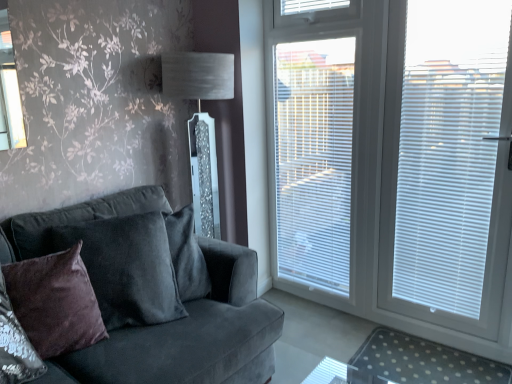
Describe the element at coordinates (311, 6) in the screenshot. I see `white plastic blinds at upper center, which ranks as the first blind in left-to-right order` at that location.

The width and height of the screenshot is (512, 384). Describe the element at coordinates (445, 184) in the screenshot. I see `white plastic blinds at right, positioned as the 1th blind in right-to-left order` at that location.

You are a GUI agent. You are given a task and a screenshot of the screen. Output one action in this format:
    pyautogui.click(x=<x>, y=<y>)
    Task: Click on the white plastic blinds at upper center, acting as the third blind starting from the right
    
    Given the screenshot: What is the action you would take?
    coord(311,6)

Between clear polka dot mat at lower right and white blinds at right, which one appears on the right side from the viewer's perspective?

From the viewer's perspective, clear polka dot mat at lower right appears more on the right side.

Considering the positions of points (463, 358) and (282, 232), is point (463, 358) closer to camera compared to point (282, 232)?

Yes.

From the image's perspective, is clear polka dot mat at lower right located above white blinds at right?

No, from the image's perspective, clear polka dot mat at lower right is not on top of white blinds at right.

This screenshot has width=512, height=384. What are the coordinates of `window above the clear polka dot mat at lower right (from the image's perspective)` in the screenshot? It's located at (392, 159).

From the image's perspective, is velvet dark gray couch at left located above or below white plastic blinds at right, which is counted as the second blind, starting from the right?

From the image's perspective, velvet dark gray couch at left appears below white plastic blinds at right, which is counted as the second blind, starting from the right.

Would you consider velvet dark gray couch at left to be distant from white plastic blinds at right, which is counted as the 2th blind, starting from the left?

velvet dark gray couch at left is far away from white plastic blinds at right, which is counted as the 2th blind, starting from the left.

From a real-world perspective, who is located lower, velvet dark gray couch at left or white plastic blinds at right, which is counted as the second blind, starting from the right?

velvet dark gray couch at left.

Does velvet dark gray couch at left have a greater width compared to white plastic blinds at right, which is counted as the 2th blind, starting from the left?

Yes.

Considering the positions of objects velvet brown pillow at left and white blinds at right in the image provided, who is more to the right, velvet brown pillow at left or white blinds at right?

white blinds at right is more to the right.

Looking at this image, which of these two, velvet brown pillow at left or white blinds at right, is wider?

Wider between the two is velvet brown pillow at left.

Does point (67, 288) come farther from viewer compared to point (386, 25)?

No, it is not.

Is point (425, 357) less distant than point (304, 0)?

Yes.

Is white plastic blinds at upper center, acting as the third blind starting from the right, at the back of clear polka dot mat at lower right?

No, clear polka dot mat at lower right is not facing the opposite direction of white plastic blinds at upper center, acting as the third blind starting from the right.

From the image's perspective, is clear polka dot mat at lower right on white plastic blinds at upper center, acting as the third blind starting from the right?

No, from the image's perspective, clear polka dot mat at lower right is not over white plastic blinds at upper center, acting as the third blind starting from the right.

Find the location of a particular element. the 2nd blind behind the clear polka dot mat at lower right, counting from the anchor's position is located at coordinates (311, 6).

Choose the correct answer: Is white plastic blinds at right, which is counted as the 2th blind, starting from the left, inside white plastic blinds at upper center, acting as the third blind starting from the right, or outside it?

white plastic blinds at right, which is counted as the 2th blind, starting from the left, cannot be found inside white plastic blinds at upper center, acting as the third blind starting from the right.

Which object is wider, white plastic blinds at right, which is counted as the 2th blind, starting from the left, or white plastic blinds at upper center, acting as the third blind starting from the right?

With larger width is white plastic blinds at right, which is counted as the 2th blind, starting from the left.

Does white plastic blinds at right, which is counted as the second blind, starting from the right, have a larger size compared to white plastic blinds at upper center, acting as the third blind starting from the right?

Yes, white plastic blinds at right, which is counted as the second blind, starting from the right, is bigger than white plastic blinds at upper center, acting as the third blind starting from the right.

Can you confirm if white plastic blinds at right, which is counted as the second blind, starting from the right, is positioned to the left of velvet brown pillow at left?

In fact, white plastic blinds at right, which is counted as the second blind, starting from the right, is to the right of velvet brown pillow at left.

Is white plastic blinds at right, which is counted as the 2th blind, starting from the left, positioned with its back to velvet brown pillow at left?

No, white plastic blinds at right, which is counted as the 2th blind, starting from the left, is not facing the opposite direction of velvet brown pillow at left.

Identify the location of pillow lying on the left of white plastic blinds at right, which is counted as the second blind, starting from the right. The image size is (512, 384). (55, 302).

Is velvet brown pillow at left bigger than velvet dark gray couch at left?

Actually, velvet brown pillow at left might be smaller than velvet dark gray couch at left.

How different are the orientations of velvet brown pillow at left and velvet dark gray couch at left in degrees?

There is a 26.8-degree angle between the facing directions of velvet brown pillow at left and velvet dark gray couch at left.

Is point (20, 317) closer to viewer compared to point (49, 360)?

That is True.

Based on the photo, from a real-world perspective, is velvet brown pillow at left physically above velvet dark gray couch at left?

Yes, from a real-world perspective, velvet brown pillow at left is over velvet dark gray couch at left

Locate an element on the screen. The height and width of the screenshot is (384, 512). plain on the right of the white blinds at right is located at coordinates (422, 362).

Locate an element on the screen. This screenshot has height=384, width=512. studio couch below the white plastic blinds at right, which is counted as the second blind, starting from the right (from a real-world perspective) is located at coordinates coord(156,297).

From the image, which object appears to be farther from velvet dark gray couch at left, white plastic blinds at right, which is counted as the 2th blind, starting from the left, or clear polka dot mat at lower right?

Based on the image, white plastic blinds at right, which is counted as the 2th blind, starting from the left, appears to be further to velvet dark gray couch at left.

Estimate the real-world distances between objects in this image. Which object is closer to velvet dark gray couch at left, clear polka dot mat at lower right or white plastic blinds at right, positioned as the 1th blind in right-to-left order?

clear polka dot mat at lower right is closer to velvet dark gray couch at left.

Considering their positions, is clear polka dot mat at lower right positioned further to white plastic blinds at upper center, which ranks as the first blind in left-to-right order, than velvet brown pillow at left?

Answer: Based on the image, velvet brown pillow at left appears to be further to white plastic blinds at upper center, which ranks as the first blind in left-to-right order.

From the picture: Estimate the real-world distances between objects in this image. Which object is further from velvet brown pillow at left, white plastic blinds at right, positioned as the third blind in left-to-right order, or white plastic blinds at right, which is counted as the 2th blind, starting from the left?

Among the two, white plastic blinds at right, positioned as the third blind in left-to-right order, is located further to velvet brown pillow at left.

Considering their positions, is white plastic blinds at right, positioned as the 1th blind in right-to-left order, positioned further to clear polka dot mat at lower right than white plastic blinds at upper center, acting as the third blind starting from the right?

white plastic blinds at upper center, acting as the third blind starting from the right, lies further to clear polka dot mat at lower right than the other object.

When comparing their distances from velvet brown pillow at left, does velvet dark gray couch at left or white blinds at right seem further?

white blinds at right.

From the image, which object appears to be nearer to velvet dark gray couch at left, velvet brown pillow at left or clear polka dot mat at lower right?

The object closer to velvet dark gray couch at left is velvet brown pillow at left.

Estimate the real-world distances between objects in this image. Which object is further from velvet dark gray couch at left, white blinds at right or white plastic blinds at right, which is counted as the 2th blind, starting from the left?

white blinds at right.

Find the location of `window between white plastic blinds at upper center, acting as the third blind starting from the right, and velvet brown pillow at left, in the vertical direction`. window between white plastic blinds at upper center, acting as the third blind starting from the right, and velvet brown pillow at left, in the vertical direction is located at coordinates (392, 159).

Image resolution: width=512 pixels, height=384 pixels. In order to click on plain situated between velvet dark gray couch at left and white plastic blinds at right, positioned as the 1th blind in right-to-left order, from left to right in this screenshot , I will do `click(422, 362)`.

Find the location of a particular element. window between velvet dark gray couch at left and white plastic blinds at right, which is counted as the 2th blind, starting from the left, from front to back is located at coordinates (392, 159).

At what (x,y) coordinates should I click in order to perform the action: click on studio couch between velvet brown pillow at left and white blinds at right in the horizontal direction. Please return your answer as a coordinate pair (x, y). This screenshot has height=384, width=512. Looking at the image, I should click on (156, 297).